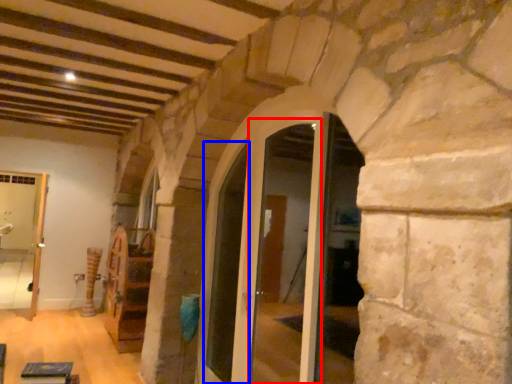
Question: Which object appears farthest to the camera in this image, glass door (highlighted by a red box) or door (highlighted by a blue box)?

Choices:
 (A) glass door
 (B) door

Answer: (B)